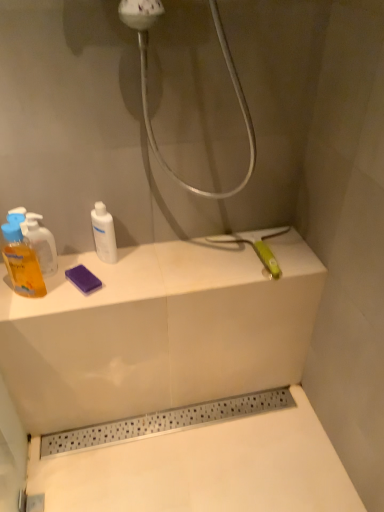
Question: Is the depth of translucent yellow liquid at left, the first mouthwash when ordered from left to right, greater than that of translucent orange liquid at left, acting as the 2th mouthwash starting from the right?

Choices:
 (A) no
 (B) yes

Answer: (A)

Question: Considering the relative positions of translucent yellow liquid at left, the first mouthwash when ordered from left to right, and translucent orange liquid at left, acting as the 2th mouthwash starting from the right, in the image provided, is translucent yellow liquid at left, the first mouthwash when ordered from left to right, to the left of translucent orange liquid at left, acting as the 2th mouthwash starting from the right, from the viewer's perspective?

Choices:
 (A) yes
 (B) no

Answer: (A)

Question: Is translucent yellow liquid at left, the first mouthwash when ordered from left to right, far away from translucent orange liquid at left, acting as the 2th mouthwash starting from the right?

Choices:
 (A) no
 (B) yes

Answer: (A)

Question: Is translucent yellow liquid at left, the first mouthwash when ordered from left to right, next to translucent orange liquid at left, acting as the 2th mouthwash starting from the right, and touching it?

Choices:
 (A) yes
 (B) no

Answer: (A)

Question: Considering the relative sizes of translucent yellow liquid at left, the first mouthwash when ordered from left to right, and translucent orange liquid at left, acting as the second mouthwash starting from the left, in the image provided, is translucent yellow liquid at left, the first mouthwash when ordered from left to right, thinner than translucent orange liquid at left, acting as the second mouthwash starting from the left,?

Choices:
 (A) yes
 (B) no

Answer: (B)

Question: Is translucent yellow liquid at left, the 3th mouthwash viewed from the right, smaller than translucent orange liquid at left, acting as the second mouthwash starting from the left?

Choices:
 (A) yes
 (B) no

Answer: (B)

Question: Does white glossy bottle at center, the first mouthwash viewed from the right, appear on the right side of translucent yellow liquid at left, the first mouthwash when ordered from left to right?

Choices:
 (A) no
 (B) yes

Answer: (B)

Question: Does white glossy bottle at center, the first mouthwash viewed from the right, have a greater width compared to translucent yellow liquid at left, the 3th mouthwash viewed from the right?

Choices:
 (A) yes
 (B) no

Answer: (B)

Question: Is the position of white glossy bottle at center, the first mouthwash viewed from the right, less distant than that of translucent yellow liquid at left, the 3th mouthwash viewed from the right?

Choices:
 (A) yes
 (B) no

Answer: (B)

Question: From the image's perspective, does white glossy bottle at center, which is counted as the 3th mouthwash, starting from the left, appear lower than translucent yellow liquid at left, the 3th mouthwash viewed from the right?

Choices:
 (A) no
 (B) yes

Answer: (A)

Question: Does white glossy bottle at center, the first mouthwash viewed from the right, come behind translucent yellow liquid at left, the 3th mouthwash viewed from the right?

Choices:
 (A) yes
 (B) no

Answer: (A)

Question: Is white glossy bottle at center, which is counted as the 3th mouthwash, starting from the left, located outside translucent yellow liquid at left, the 3th mouthwash viewed from the right?

Choices:
 (A) no
 (B) yes

Answer: (B)

Question: From the image's perspective, is translucent orange liquid at left, acting as the second mouthwash starting from the left, on top of translucent yellow liquid at left, the first mouthwash when ordered from left to right?

Choices:
 (A) yes
 (B) no

Answer: (A)